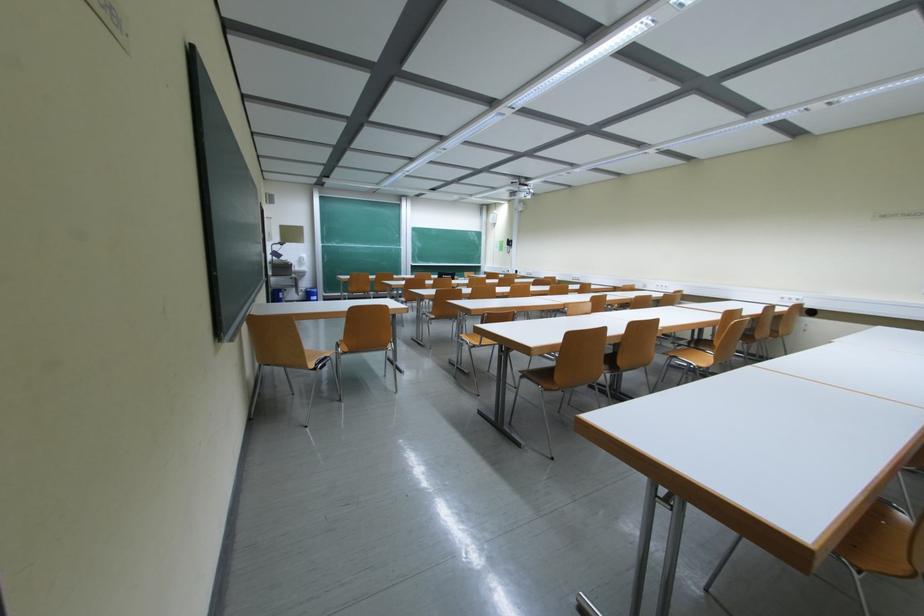
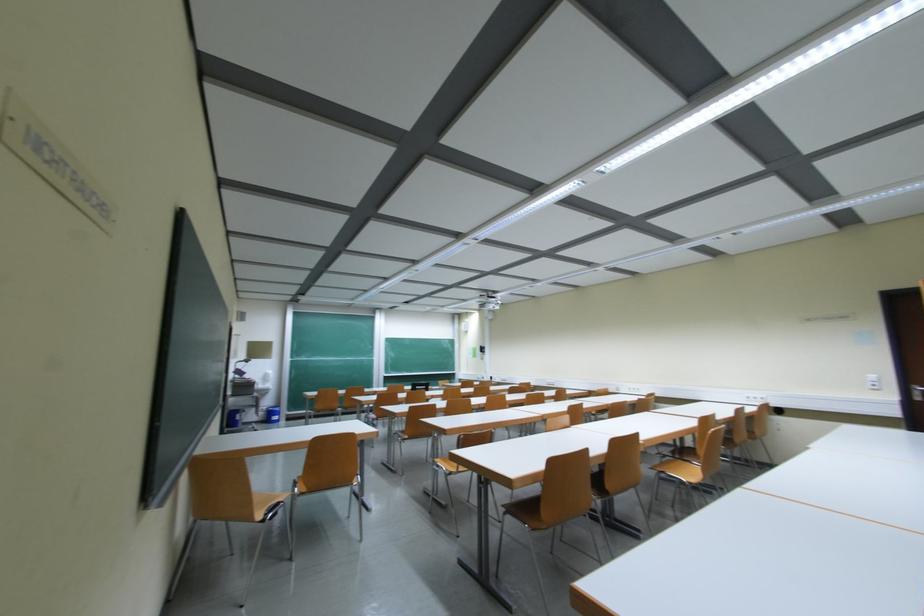
Question: The images are taken continuously from a first-person perspective. In which direction is your viewpoint rotating?

Choices:
 (A) Left
 (B) Right
 (C) Up
 (D) Down

Answer: (C)